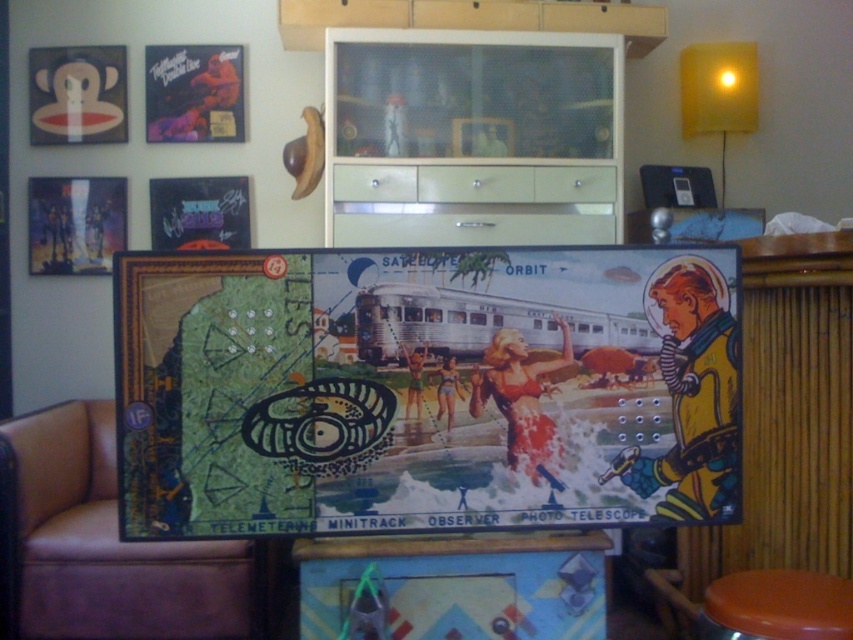
Question: Observing the image, what is the correct spatial positioning of brown leather couch at lower left in reference to matte white monkey at upper left?

Choices:
 (A) right
 (B) left

Answer: (A)

Question: Which object is positioned farthest from the matte black poster at upper left?

Choices:
 (A) shiny metallic poster at center
 (B) matte white monkey at upper left
 (C) brown leather couch at lower left
 (D) metallic silver poster at upper left

Answer: (A)

Question: Can you confirm if matte vinyl record at upper left is positioned to the left of matte white monkey at upper left?

Choices:
 (A) no
 (B) yes

Answer: (A)

Question: Is smooth brown stool at lower right to the right of matte black poster at upper left from the viewer's perspective?

Choices:
 (A) no
 (B) yes

Answer: (B)

Question: Which point is closer to the camera taking this photo?

Choices:
 (A) (198, 97)
 (B) (723, 604)
 (C) (100, 64)

Answer: (B)

Question: Estimate the real-world distances between objects in this image. Which object is closer to the smooth brown stool at lower right?

Choices:
 (A) shiny metallic poster at center
 (B) matte vinyl record at upper left
 (C) brown leather couch at lower left

Answer: (A)